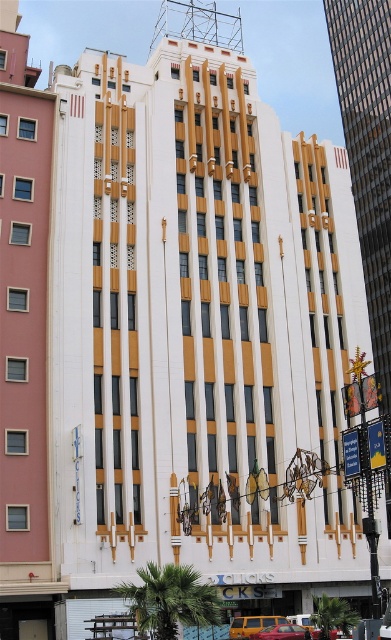
Question: Is yellow matte taxi at center thinner than metallic gold car at center?

Choices:
 (A) yes
 (B) no

Answer: (B)

Question: Which of the following is the farthest from the observer?

Choices:
 (A) (3, 195)
 (B) (303, 632)
 (C) (229, 630)

Answer: (A)

Question: Is yellow matte taxi at center positioned at the back of metallic gold car at center?

Choices:
 (A) yes
 (B) no

Answer: (B)

Question: Which of the following is the closest to the observer?

Choices:
 (A) (319, 634)
 (B) (25, 364)
 (C) (256, 630)
 (D) (288, 632)

Answer: (D)

Question: Considering the real-world distances, which object is closest to the pink matte building at left?

Choices:
 (A) yellow matte taxi at center
 (B) matte red car at center
 (C) metallic gold car at center

Answer: (A)

Question: Does pink matte building at left have a lesser width compared to matte red car at center?

Choices:
 (A) yes
 (B) no

Answer: (B)